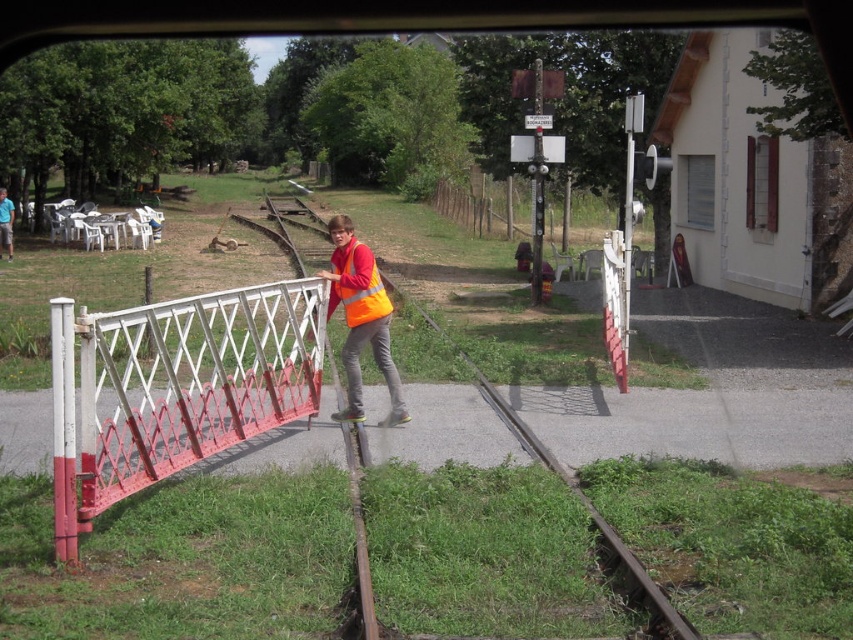
Question: Which point appears closest to the camera in this image?

Choices:
 (A) (389, 362)
 (B) (9, 196)

Answer: (A)

Question: Does metallic white bridge at left appear over matte orange vest at center?

Choices:
 (A) yes
 (B) no

Answer: (B)

Question: Which object is closer to the camera taking this photo?

Choices:
 (A) metallic white bridge at left
 (B) matte orange vest at center

Answer: (A)

Question: Is wooden fence at center further to camera compared to matte orange vest at center?

Choices:
 (A) no
 (B) yes

Answer: (B)

Question: Which point appears farthest from the camera in this image?

Choices:
 (A) (456, 198)
 (B) (379, 365)
 (C) (152, 419)

Answer: (A)

Question: Is metallic white bridge at left to the left of matte orange vest at center from the viewer's perspective?

Choices:
 (A) no
 (B) yes

Answer: (A)